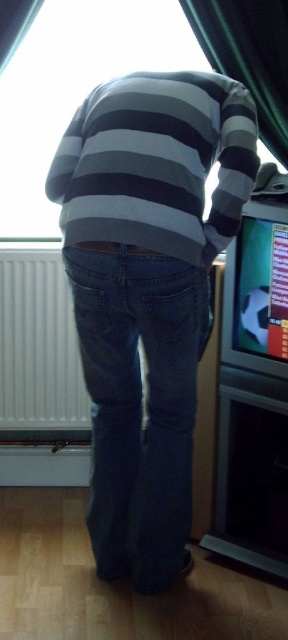
You are a photographer setting up a shoot in this room. You want to position a model wearing the denim jeans at center so that the white plastic radiator at lower left is visible in the background. Is the radiator currently behind the jeans in the scene?

Yes, the denim jeans at center is in front of the white plastic radiator at lower left, so the radiator would be visible in the background behind the jeans.

You are a drone operator trying to navigate a small drone through the room. The drone must pass between the two points, point (131,45) and point (262,122). Based on their positions, which point should the drone approach first to ensure it stays closer to the viewer?

The drone should approach point (131,45) first because it is closer to the viewer compared to point (262,122), ensuring the drone stays nearer to the observer as it navigates between them.

You are a home inspector assessing the placement of the white plastic radiator at lower left in the room. Based on the image, what are the coordinates of its 2D location?

The 2D location of the white plastic radiator at lower left is at point (x=38, y=346).